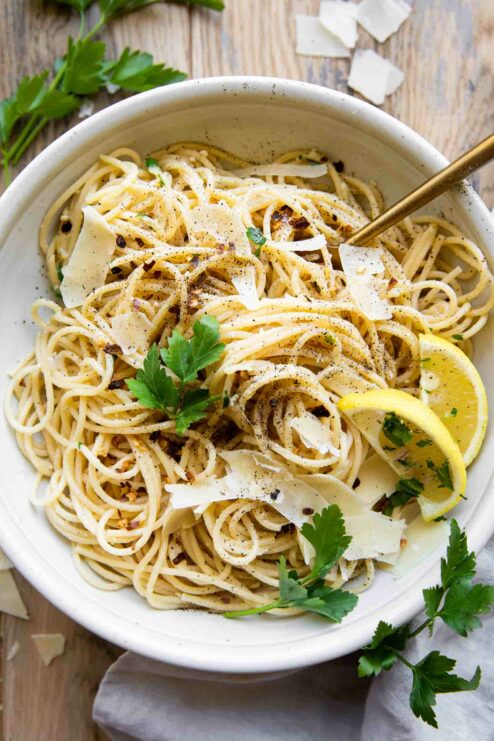
Find the location of a particular element. bowl is located at coordinates (265, 641).